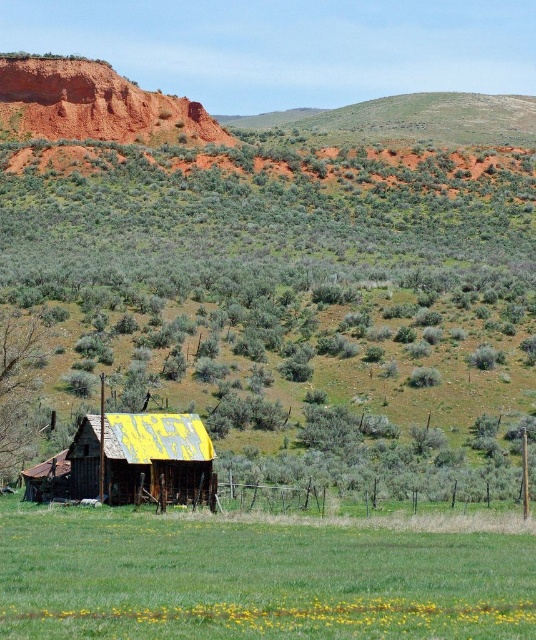
You are a farmer standing at the edge of your property near the wire fence. You need to reach the rusty corrugated metal hut at lower left to check on some equipment. However, there is a green grassy field at lower center between you and the hut. Can you walk directly to the hut without going around the field?

The green grassy field at lower center and the rusty corrugated metal hut at lower left are 23.15 meters apart. Since the field is between you and the hut, you can walk directly to the hut through the field as there is no obstruction mentioned in the scene description.

You are standing at the center of the image. Based on the coordinates provided, where is the green grassy field at lower center located?

The green grassy field at lower center is located at coordinates point (254, 579).

You are standing in front of the rustic wooden building with a yellow roof and want to walk towards the two points marked in the image. Which point, point (84, 577) or point (157, 461), will you reach first?

You will reach point (84, 577) first because it is closer to you than point (157, 461).